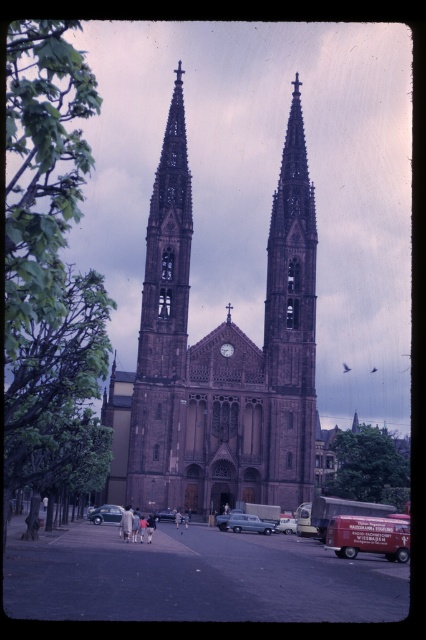
Question: Can you confirm if dark brown stone tower at center is smaller than shiny silver sedan at center?

Choices:
 (A) yes
 (B) no

Answer: (B)

Question: Which point is closer to the camera?

Choices:
 (A) brown stone tower at center
 (B) shiny silver sedan at center
 (C) brown stone church at center
 (D) dark brown stone tower at center

Answer: (A)

Question: Based on their relative distances, which object is nearer to the metallic silver van at center?

Choices:
 (A) brown stone church at center
 (B) dark brown stone tower at center
 (C) light blue metallic car at center
 (D) shiny silver sedan at center

Answer: (C)

Question: Which object appears closest to the camera in this image?

Choices:
 (A) brown stone church at center
 (B) brown stone tower at center
 (C) dark brown stone tower at center
 (D) shiny silver sedan at center

Answer: (B)

Question: In this image, where is brown stone tower at center located relative to metallic silver van at center?

Choices:
 (A) below
 (B) above

Answer: (B)

Question: Is brown stone church at center further to the viewer compared to shiny silver sedan at center?

Choices:
 (A) yes
 (B) no

Answer: (B)